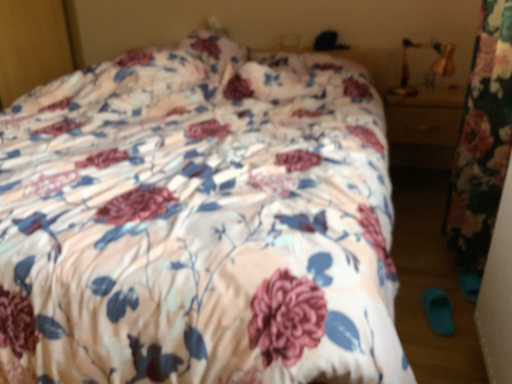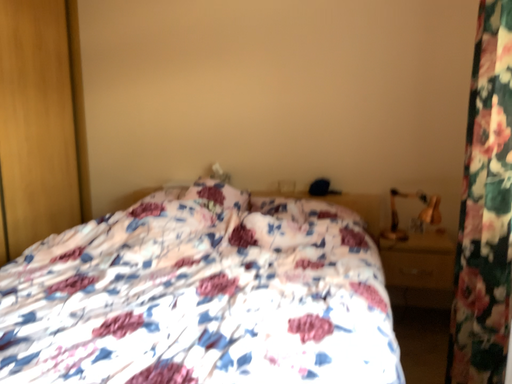
Question: How did the camera likely rotate when shooting the video?

Choices:
 (A) rotated upward
 (B) rotated downward

Answer: (A)